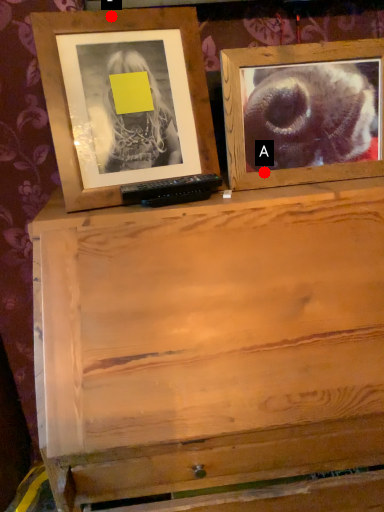
Question: Two points are circled on the image, labeled by A and B beside each circle. Which of the following is the farthest from the observer?

Choices:
 (A) A is further
 (B) B is further

Answer: (A)